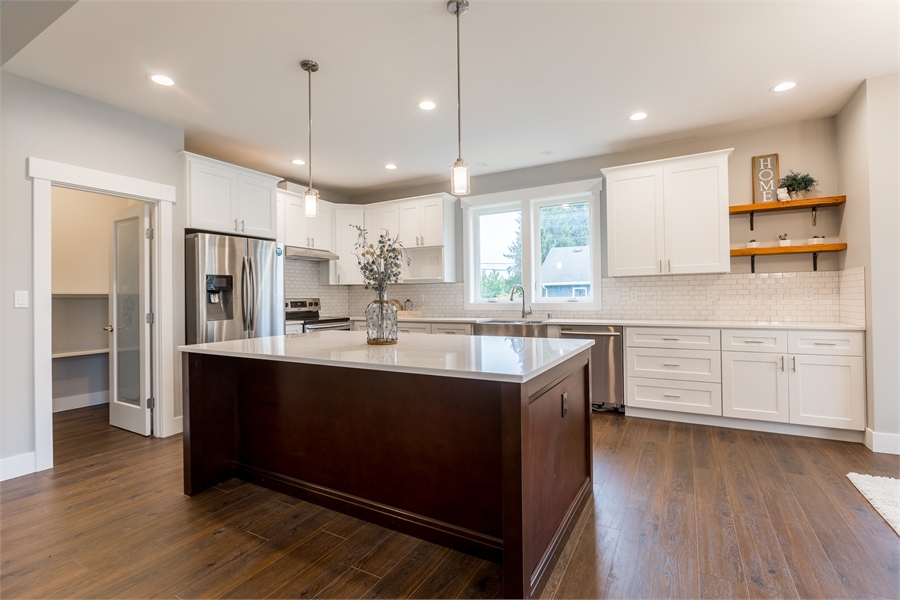
Find the location of `drawers`. drawers is located at coordinates (410, 327), (441, 326), (651, 338), (644, 364), (640, 385), (734, 337), (795, 344).